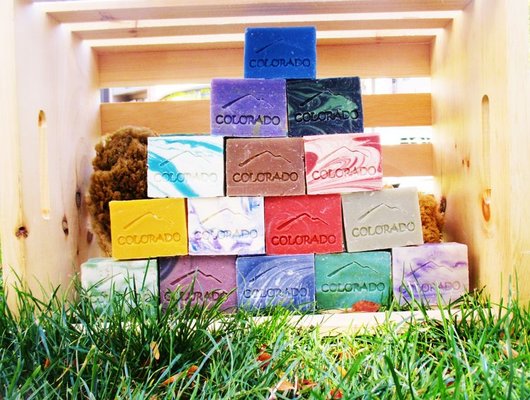
Locate an element on the screen. The image size is (530, 400). decorative soap is located at coordinates (273, 48).